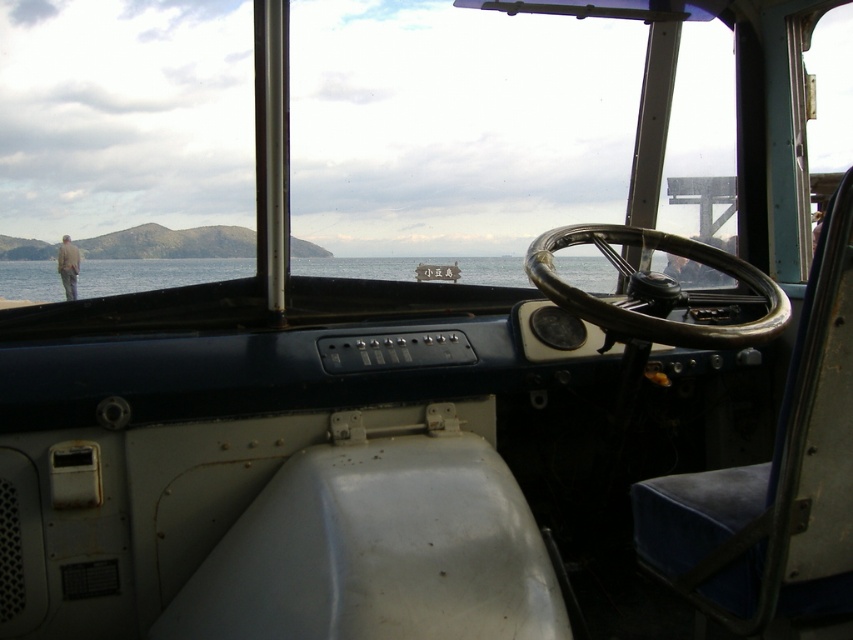
Question: Which point appears closest to the camera in this image?

Choices:
 (A) (431, 266)
 (B) (741, 268)
 (C) (480, 273)

Answer: (B)

Question: Is shiny chrome steering wheel at center below light brown leather jacket at center?

Choices:
 (A) no
 (B) yes

Answer: (B)

Question: Is clear blue water at center behind light brown leather jacket at center?

Choices:
 (A) yes
 (B) no

Answer: (B)

Question: Can you confirm if light brown leather jacket at center is positioned to the right of wooden signboard at center?

Choices:
 (A) no
 (B) yes

Answer: (A)

Question: Which is nearer to the shiny chrome steering wheel at center?

Choices:
 (A) clear blue water at center
 (B) light brown leather jacket at center

Answer: (A)

Question: Which of these objects is positioned farthest from the wooden signboard at center?

Choices:
 (A) shiny chrome steering wheel at center
 (B) clear blue water at center
 (C) light brown leather jacket at center

Answer: (C)